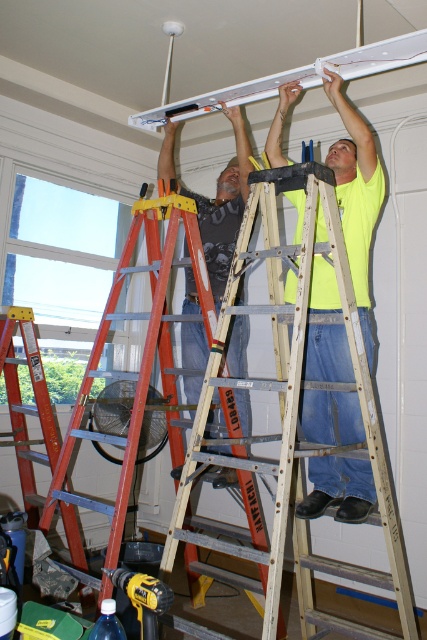
In the scene shown: Does orange metallic ladder at center appear under yellow plastic drill at lower left?

No.

The image size is (427, 640). What do you see at coordinates (26, 404) in the screenshot? I see `orange metallic ladder at center` at bounding box center [26, 404].

Does point (3, 355) lie in front of point (108, 576)?

That is False.

Locate an element on the screen. This screenshot has width=427, height=640. orange metallic ladder at center is located at coordinates (26, 404).

Is point (371, 413) positioned in front of point (140, 618)?

That is False.

The width and height of the screenshot is (427, 640). Find the location of `wooden ladder at center`. wooden ladder at center is located at coordinates (295, 424).

Find the location of a particular element. This screenshot has width=427, height=640. wooden ladder at center is located at coordinates (295, 424).

What are the coordinates of `wooden ladder at center` in the screenshot? It's located at click(295, 424).

Measure the distance from wooden ladder at center to matte black shirt at upper center.

They are 28.86 inches apart.

What do you see at coordinates (295, 424) in the screenshot? The image size is (427, 640). I see `wooden ladder at center` at bounding box center [295, 424].

In order to click on wooden ladder at center in this screenshot , I will do `click(295, 424)`.